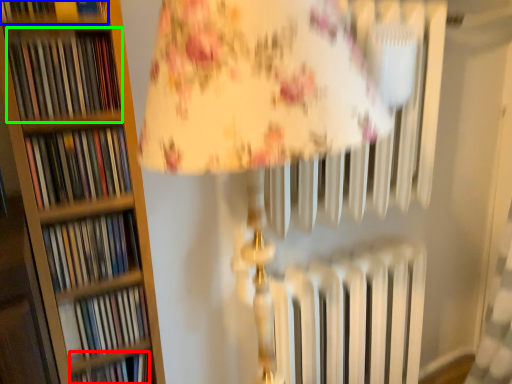
Question: Estimate the real-world distances between objects in this image. Which object is closer to book (highlighted by a red box), book (highlighted by a blue box) or book (highlighted by a green box)?

Choices:
 (A) book
 (B) book

Answer: (B)